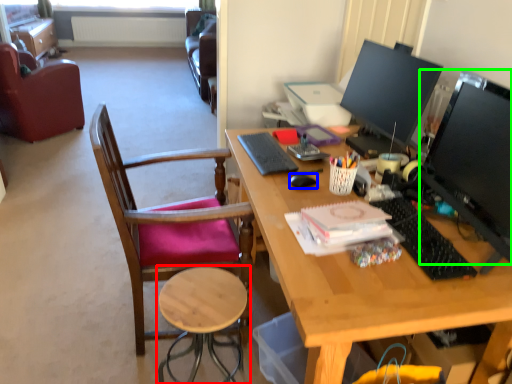
Question: Which object is the closest to the stool (highlighted by a red box)? Choose among these: mouse (highlighted by a blue box) or television (highlighted by a green box).

Choices:
 (A) mouse
 (B) television

Answer: (A)